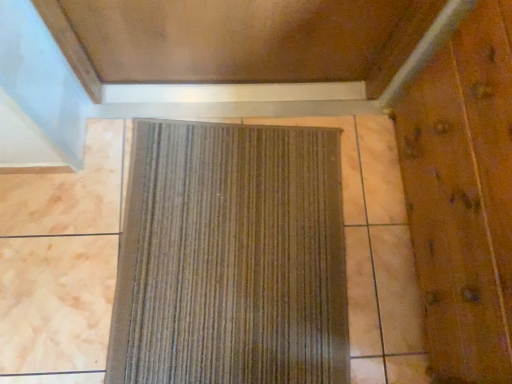
At what (x,y) coordinates should I click in order to perform the action: click on vacant region to the left of brown textured mat at center. Please return your answer as a coordinate pair (x, y). The image size is (512, 384). Looking at the image, I should click on (75, 228).